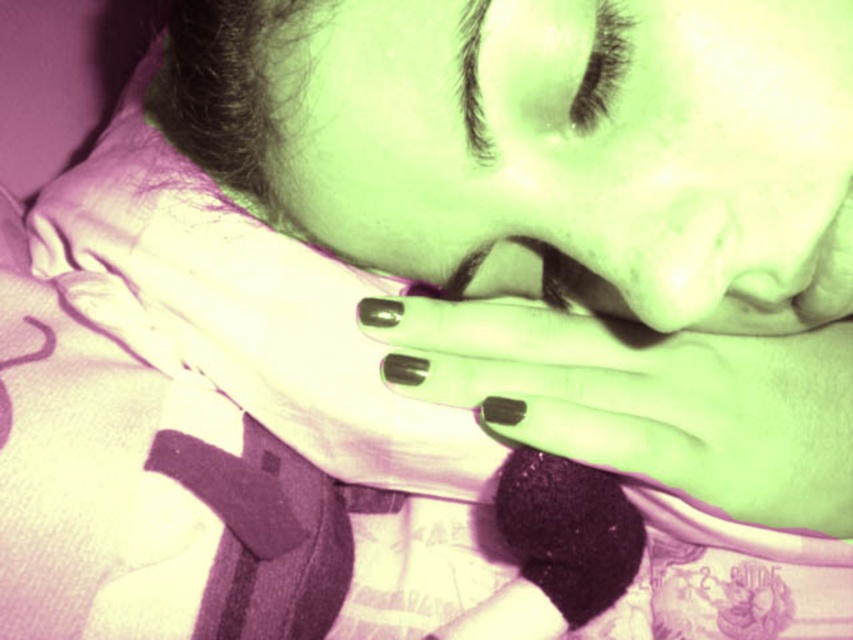
Question: Which of the following is the closest to the observer?

Choices:
 (A) matte green skin at center
 (B) black eyelashes at upper center
 (C) matte black nails at center

Answer: (A)

Question: Does matte green skin at center appear on the right side of matte black nails at center?

Choices:
 (A) no
 (B) yes

Answer: (A)

Question: Does matte green skin at center have a greater width compared to matte black nails at center?

Choices:
 (A) yes
 (B) no

Answer: (B)

Question: From the image, what is the correct spatial relationship of matte green skin at center in relation to black eyelashes at upper center?

Choices:
 (A) left
 (B) right

Answer: (A)

Question: Which point is closer to the camera?

Choices:
 (A) black eyelashes at upper center
 (B) matte black nails at center
 (C) matte green skin at center

Answer: (C)

Question: Which point is farther from the camera taking this photo?

Choices:
 (A) (401, 122)
 (B) (538, 316)

Answer: (B)